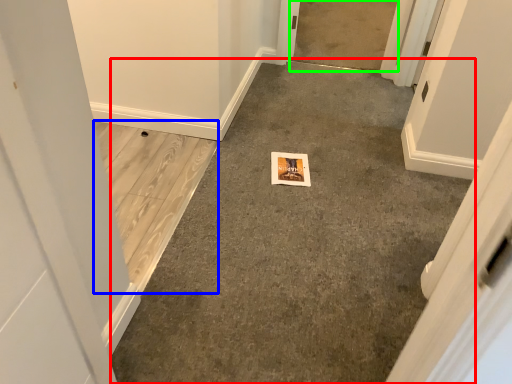
Question: Based on their relative distances, which object is nearer to concrete (highlighted by a red box)? Choose from concrete (highlighted by a blue box) and concrete (highlighted by a green box).

Choices:
 (A) concrete
 (B) concrete

Answer: (A)